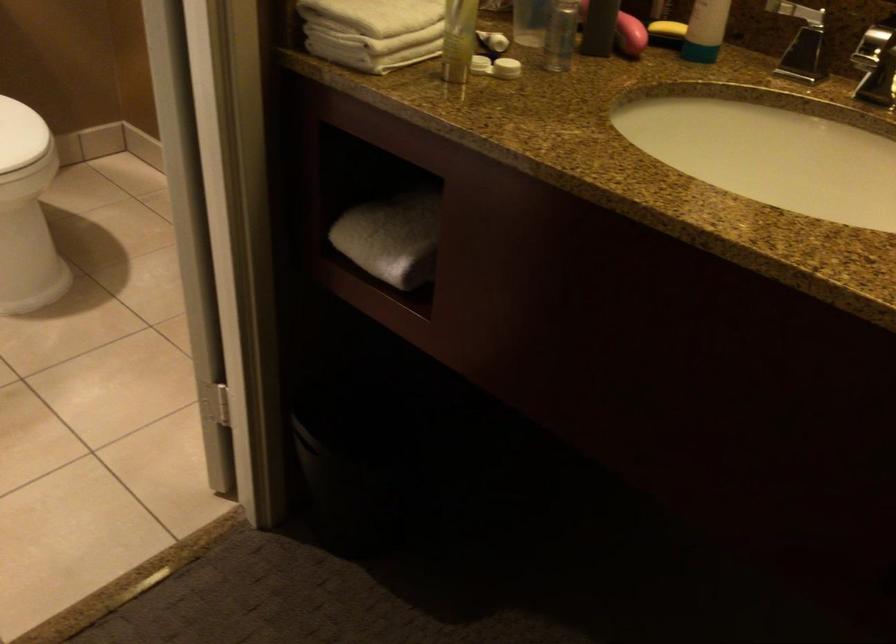
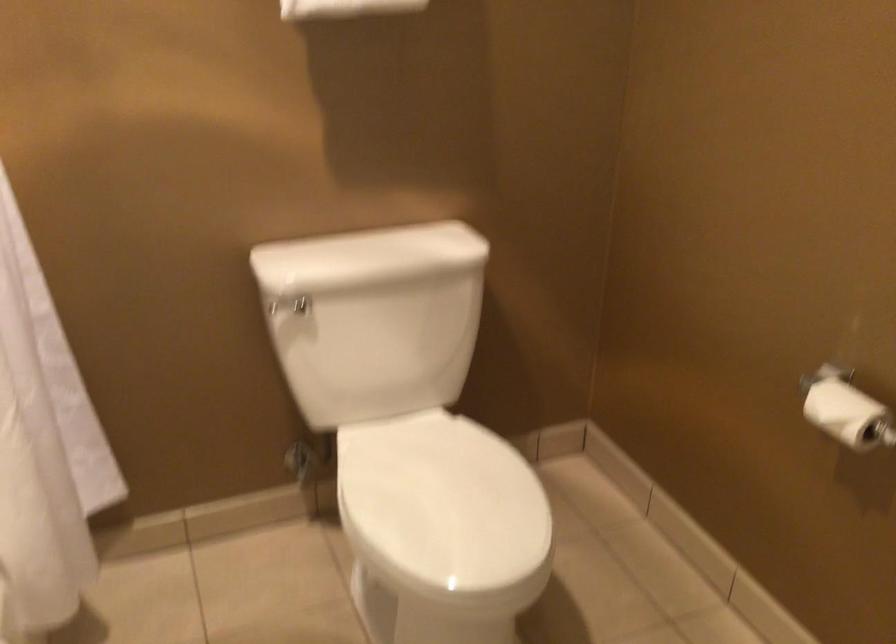
Based on the photo, the images are taken continuously from a first-person perspective. In which direction are you moving?

The cameraman moved toward left, forward.